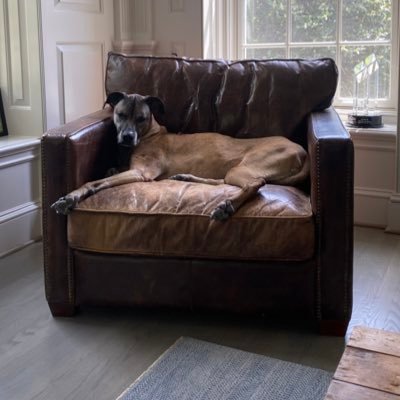
Locate an element on the screen. The width and height of the screenshot is (400, 400). back cushion is located at coordinates (259, 79).